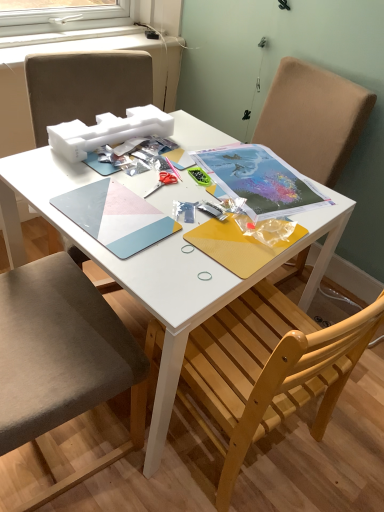
Identify the location of free location to the left of metallic silver scissors at center. The image size is (384, 512). (100, 180).